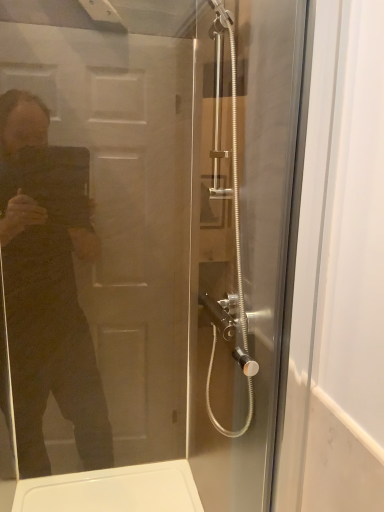
Question: Could you tell me if clear glass shower door at center, acting as the 1th screen door starting from the front, is turned towards clear glass shower door at center, the 1th screen door positioned from the back?

Choices:
 (A) yes
 (B) no

Answer: (A)

Question: Is clear glass shower door at center, acting as the 1th screen door starting from the front, wider than clear glass shower door at center, which appears as the second screen door when viewed from the front?

Choices:
 (A) no
 (B) yes

Answer: (A)

Question: Is clear glass shower door at center, acting as the 1th screen door starting from the front, at the left side of clear glass shower door at center, the 1th screen door positioned from the back?

Choices:
 (A) yes
 (B) no

Answer: (A)

Question: Can you confirm if clear glass shower door at center, acting as the 1th screen door starting from the front, is taller than clear glass shower door at center, the 1th screen door positioned from the back?

Choices:
 (A) no
 (B) yes

Answer: (A)

Question: Is clear glass shower door at center, acting as the 1th screen door starting from the front, turned away from clear glass shower door at center, which appears as the second screen door when viewed from the front?

Choices:
 (A) yes
 (B) no

Answer: (A)

Question: Would you say clear glass shower door at center, acting as the 1th screen door starting from the front, is a long distance from clear glass shower door at center, which appears as the second screen door when viewed from the front?

Choices:
 (A) yes
 (B) no

Answer: (B)

Question: Considering the relative sizes of clear glass shower door at center, which appears as the second screen door when viewed from the front, and clear glass shower door at center, acting as the 1th screen door starting from the front, in the image provided, is clear glass shower door at center, which appears as the second screen door when viewed from the front, smaller than clear glass shower door at center, acting as the 1th screen door starting from the front,?

Choices:
 (A) no
 (B) yes

Answer: (A)

Question: Is clear glass shower door at center, the 1th screen door positioned from the back, facing towards clear glass shower door at center, acting as the 1th screen door starting from the front?

Choices:
 (A) no
 (B) yes

Answer: (A)

Question: Does clear glass shower door at center, which appears as the second screen door when viewed from the front, have a lesser height compared to clear glass shower door at center, acting as the 1th screen door starting from the front?

Choices:
 (A) no
 (B) yes

Answer: (A)

Question: Is clear glass shower door at center, which appears as the second screen door when viewed from the front, oriented away from clear glass shower door at center, the 2th screen door when ordered from back to front?

Choices:
 (A) yes
 (B) no

Answer: (B)

Question: Considering the relative sizes of clear glass shower door at center, the 1th screen door positioned from the back, and clear glass shower door at center, acting as the 1th screen door starting from the front, in the image provided, is clear glass shower door at center, the 1th screen door positioned from the back, bigger than clear glass shower door at center, acting as the 1th screen door starting from the front,?

Choices:
 (A) yes
 (B) no

Answer: (A)

Question: Considering the relative positions of clear glass shower door at center, which appears as the second screen door when viewed from the front, and clear glass shower door at center, acting as the 1th screen door starting from the front, in the image provided, is clear glass shower door at center, which appears as the second screen door when viewed from the front, to the right of clear glass shower door at center, acting as the 1th screen door starting from the front, from the viewer's perspective?

Choices:
 (A) no
 (B) yes

Answer: (B)

Question: Considering the positions of clear glass shower door at center, the 1th screen door positioned from the back, and clear glass shower door at center, acting as the 1th screen door starting from the front, in the image, is clear glass shower door at center, the 1th screen door positioned from the back, bigger or smaller than clear glass shower door at center, acting as the 1th screen door starting from the front,?

Choices:
 (A) big
 (B) small

Answer: (A)